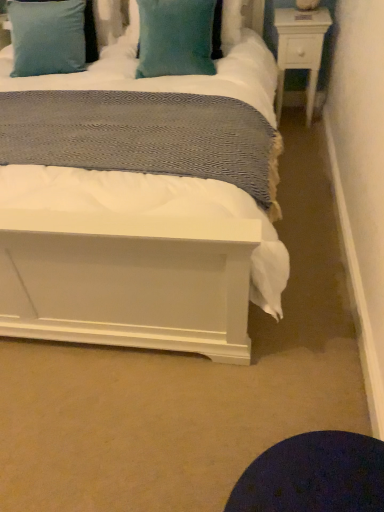
The width and height of the screenshot is (384, 512). What do you see at coordinates (300, 49) in the screenshot? I see `white wood nightstand at upper right` at bounding box center [300, 49].

Looking at this image, in order to face teal velvet pillow at upper center, which is the 1th pillow from left to right, should I rotate leftwards or rightwards?

To face it directly, rotate left by 18.482 degrees.

The height and width of the screenshot is (512, 384). What do you see at coordinates (175, 38) in the screenshot?
I see `teal plush pillow at upper center, which ranks as the first pillow in right-to-left order` at bounding box center [175, 38].

The image size is (384, 512). In order to click on white wood nightstand at upper right in this screenshot , I will do `click(300, 49)`.

Locate an element on the screen. This screenshot has height=512, width=384. pillow below the teal velvet pillow at upper center, which is the 2th pillow from right to left (from a real-world perspective) is located at coordinates (175, 38).

Which object is further away from the camera, teal plush pillow at upper center, placed as the 2th pillow when sorted from left to right, or teal velvet pillow at upper center, which is the 2th pillow from right to left?

teal velvet pillow at upper center, which is the 2th pillow from right to left, is further away from the camera.

Is teal plush pillow at upper center, which ranks as the first pillow in right-to-left order, bigger or smaller than teal velvet pillow at upper center, which is the 1th pillow from left to right?

Considering their sizes, teal plush pillow at upper center, which ranks as the first pillow in right-to-left order, takes up less space than teal velvet pillow at upper center, which is the 1th pillow from left to right.

From the picture: Does teal plush pillow at upper center, which ranks as the first pillow in right-to-left order, have a lesser width compared to teal velvet pillow at upper center, which is the 2th pillow from right to left?

Incorrect, the width of teal plush pillow at upper center, which ranks as the first pillow in right-to-left order, is not less than that of teal velvet pillow at upper center, which is the 2th pillow from right to left.

From a real-world perspective, is teal velvet pillow at upper center, which is the 2th pillow from right to left, above or below white wood nightstand at upper right?

teal velvet pillow at upper center, which is the 2th pillow from right to left, is above white wood nightstand at upper right.

Would you say teal velvet pillow at upper center, which is the 1th pillow from left to right, is inside or outside white wood nightstand at upper right?

teal velvet pillow at upper center, which is the 1th pillow from left to right, is located beyond the bounds of white wood nightstand at upper right.

Can you tell me how much teal velvet pillow at upper center, which is the 2th pillow from right to left, and white wood nightstand at upper right differ in facing direction?

teal velvet pillow at upper center, which is the 2th pillow from right to left, and white wood nightstand at upper right are facing 1.78 degrees away from each other.

From the picture: From the image's perspective, does teal velvet pillow at upper center, which is the 2th pillow from right to left, appear lower than white wood nightstand at upper right?

No, from the image's perspective, teal velvet pillow at upper center, which is the 2th pillow from right to left, is not beneath white wood nightstand at upper right.

Is white wood nightstand at upper right beside teal plush pillow at upper center, which ranks as the first pillow in right-to-left order?

white wood nightstand at upper right is not next to teal plush pillow at upper center, which ranks as the first pillow in right-to-left order, and they're not touching.

Is the depth of white wood nightstand at upper right greater than that of teal plush pillow at upper center, placed as the 2th pillow when sorted from left to right?

Yes, it is behind teal plush pillow at upper center, placed as the 2th pillow when sorted from left to right.

Which of these two, white wood nightstand at upper right or teal plush pillow at upper center, placed as the 2th pillow when sorted from left to right, stands taller?

white wood nightstand at upper right.

From a real-world perspective, does white wood nightstand at upper right sit lower than teal plush pillow at upper center, which ranks as the first pillow in right-to-left order?

Yes, from a real-world perspective, white wood nightstand at upper right is under teal plush pillow at upper center, which ranks as the first pillow in right-to-left order.

The image size is (384, 512). I want to click on pillow that is the 1st object located in front of the white wood nightstand at upper right, so click(47, 37).

Does white wood nightstand at upper right turn towards teal velvet pillow at upper center, which is the 2th pillow from right to left?

No.

Is white wood nightstand at upper right to the right of teal velvet pillow at upper center, which is the 2th pillow from right to left, from the viewer's perspective?

Correct, you'll find white wood nightstand at upper right to the right of teal velvet pillow at upper center, which is the 2th pillow from right to left.

Is teal plush pillow at upper center, which ranks as the first pillow in right-to-left order, taller than white wood nightstand at upper right?

In fact, teal plush pillow at upper center, which ranks as the first pillow in right-to-left order, may be shorter than white wood nightstand at upper right.

How distant is teal plush pillow at upper center, which ranks as the first pillow in right-to-left order, from white wood nightstand at upper right?

teal plush pillow at upper center, which ranks as the first pillow in right-to-left order, is 26.56 inches from white wood nightstand at upper right.

Considering the points (189, 13) and (293, 64), which point is in front, point (189, 13) or point (293, 64)?

Positioned in front is point (189, 13).

Is teal plush pillow at upper center, which ranks as the first pillow in right-to-left order, facing towards white wood nightstand at upper right?

No, teal plush pillow at upper center, which ranks as the first pillow in right-to-left order, is not aimed at white wood nightstand at upper right.

Can you confirm if teal velvet pillow at upper center, which is the 2th pillow from right to left, is wider than teal plush pillow at upper center, placed as the 2th pillow when sorted from left to right?

In fact, teal velvet pillow at upper center, which is the 2th pillow from right to left, might be narrower than teal plush pillow at upper center, placed as the 2th pillow when sorted from left to right.

In the scene shown: Could you tell me if teal velvet pillow at upper center, which is the 1th pillow from left to right, is facing teal plush pillow at upper center, which ranks as the first pillow in right-to-left order?

No.

Which is correct: teal velvet pillow at upper center, which is the 2th pillow from right to left, is inside teal plush pillow at upper center, which ranks as the first pillow in right-to-left order, or outside of it?

teal velvet pillow at upper center, which is the 2th pillow from right to left, is not inside teal plush pillow at upper center, which ranks as the first pillow in right-to-left order, it's outside.

Considering their positions, is teal velvet pillow at upper center, which is the 2th pillow from right to left, located in front of or behind teal plush pillow at upper center, placed as the 2th pillow when sorted from left to right?

teal velvet pillow at upper center, which is the 2th pillow from right to left, is behind teal plush pillow at upper center, placed as the 2th pillow when sorted from left to right.

What are the coordinates of `pillow above the teal plush pillow at upper center, placed as the 2th pillow when sorted from left to right (from a real-world perspective)` in the screenshot? It's located at (47, 37).

Find the location of a particular element. the 2nd pillow to the left of the white wood nightstand at upper right, starting your count from the anchor is located at coordinates (47, 37).

Based on their spatial positions, is teal velvet pillow at upper center, which is the 1th pillow from left to right, or white wood nightstand at upper right further from teal plush pillow at upper center, placed as the 2th pillow when sorted from left to right?

white wood nightstand at upper right.

Estimate the real-world distances between objects in this image. Which object is closer to white wood nightstand at upper right, teal plush pillow at upper center, which ranks as the first pillow in right-to-left order, or teal velvet pillow at upper center, which is the 2th pillow from right to left?

teal plush pillow at upper center, which ranks as the first pillow in right-to-left order, is positioned closer to the anchor white wood nightstand at upper right.

Estimate the real-world distances between objects in this image. Which object is further from teal velvet pillow at upper center, which is the 1th pillow from left to right, white wood nightstand at upper right or teal plush pillow at upper center, placed as the 2th pillow when sorted from left to right?

Based on the image, white wood nightstand at upper right appears to be further to teal velvet pillow at upper center, which is the 1th pillow from left to right.

Considering their positions, is white wood nightstand at upper right positioned closer to teal plush pillow at upper center, placed as the 2th pillow when sorted from left to right, than teal velvet pillow at upper center, which is the 1th pillow from left to right?

teal velvet pillow at upper center, which is the 1th pillow from left to right, is closer to teal plush pillow at upper center, placed as the 2th pillow when sorted from left to right.

When comparing their distances from white wood nightstand at upper right, does teal velvet pillow at upper center, which is the 1th pillow from left to right, or teal plush pillow at upper center, which ranks as the first pillow in right-to-left order, seem closer?

teal plush pillow at upper center, which ranks as the first pillow in right-to-left order, lies closer to white wood nightstand at upper right than the other object.

Based on their spatial positions, is teal plush pillow at upper center, which ranks as the first pillow in right-to-left order, or white wood nightstand at upper right further from teal velvet pillow at upper center, which is the 1th pillow from left to right?

The object further to teal velvet pillow at upper center, which is the 1th pillow from left to right, is white wood nightstand at upper right.

Find the location of a particular element. The height and width of the screenshot is (512, 384). pillow between teal velvet pillow at upper center, which is the 2th pillow from right to left, and white wood nightstand at upper right, in the horizontal direction is located at coordinates (175, 38).